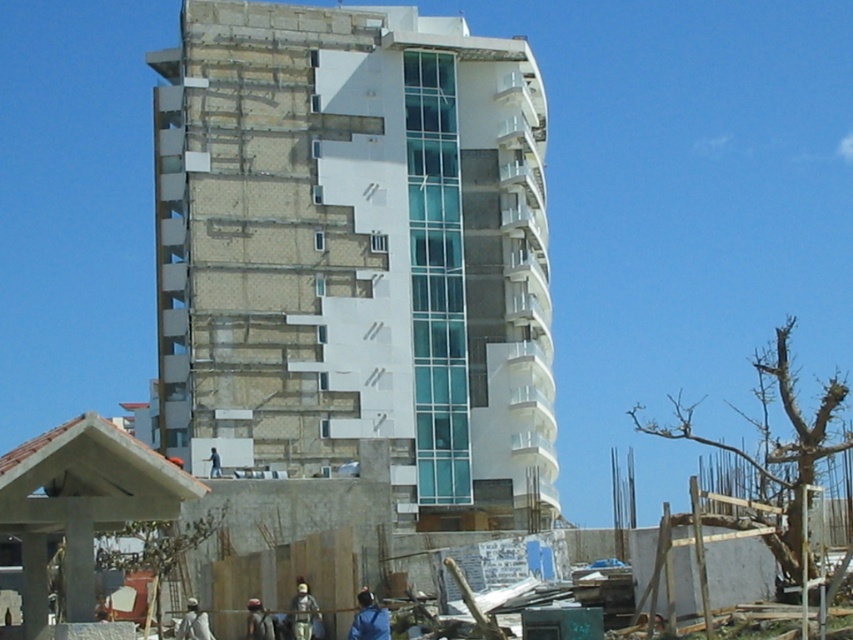
Question: Which point is farther to the camera?

Choices:
 (A) (200, 618)
 (B) (299, 609)
 (C) (210, 449)
 (D) (231, 323)

Answer: (D)

Question: Does light brown fabric jacket at lower center come in front of blue fabric person at center?

Choices:
 (A) no
 (B) yes

Answer: (B)

Question: Is blue fabric bag at lower center thinner than blue fabric person at center?

Choices:
 (A) yes
 (B) no

Answer: (B)

Question: Which of the following is the closest to the observer?

Choices:
 (A) tap(248, 605)
 (B) tap(215, 472)

Answer: (A)

Question: Can you confirm if white concrete building at center is thinner than white fabric at lower center?

Choices:
 (A) no
 (B) yes

Answer: (A)

Question: Considering the real-world distances, which object is closest to the white fabric at lower center?

Choices:
 (A) light brown leather jacket at lower center
 (B) white concrete building at center

Answer: (A)